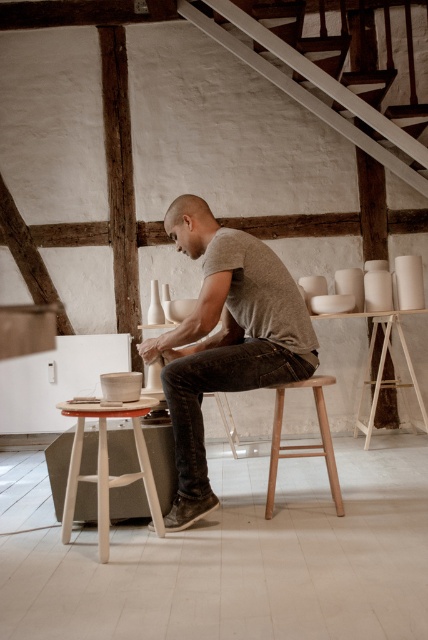
You are a visitor in the pottery studio and want to sit on the stool that is on the right side. Which stool should you choose between the white wood stool at center and the light brown wooden stool at center?

The light brown wooden stool at center is on the right side, so you should choose the light brown wooden stool at center.